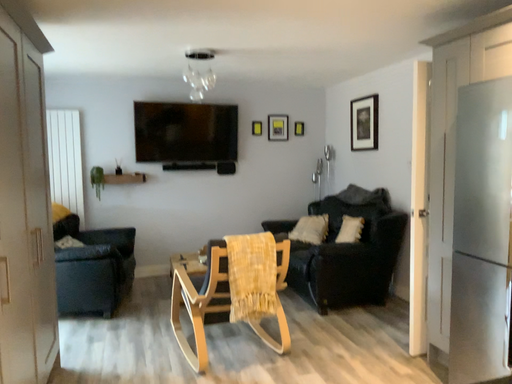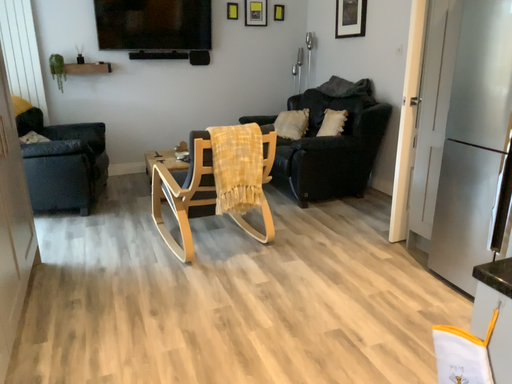
Question: Which way did the camera rotate in the video?

Choices:
 (A) rotated upward
 (B) rotated downward

Answer: (B)